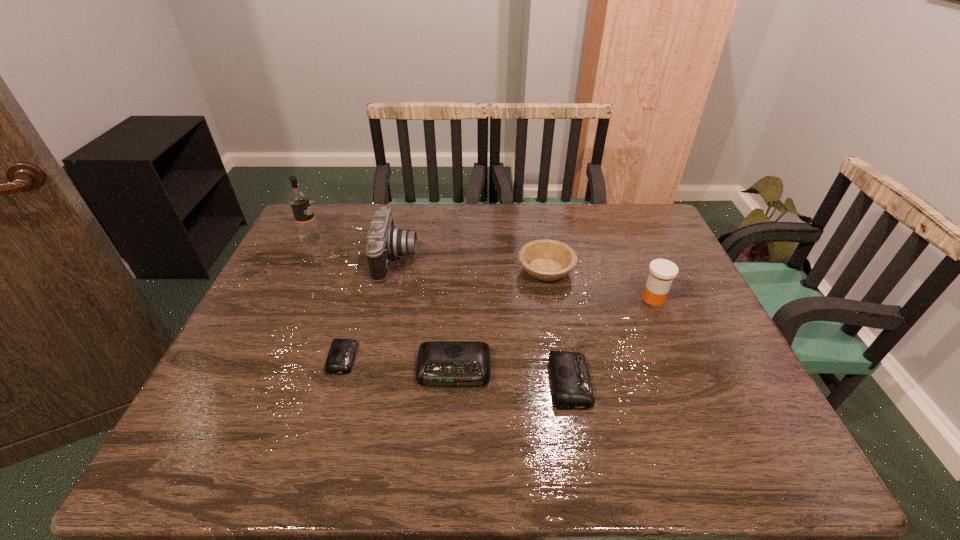
Identify which object is the closest to the second tallest object. Please provide its 2D coordinates. Your answer should be formatted as a tuple, i.e. [(x, y)], where the tuple contains the x and y coordinates of a point satisfying the conditions above.

[(299, 200)]

You are a GUI agent. You are given a task and a screenshot of the screen. Output one action in this format:
    pyautogui.click(x=<x>, y=<y>)
    Task: Click on the object that is the fourth closest to the bowl
    Image resolution: width=960 pixels, height=540 pixels.
    Given the screenshot: What is the action you would take?
    point(385,241)

This screenshot has width=960, height=540. What are the coordinates of `alarm clock object that ranks as the closest to the third tallest object` in the screenshot? It's located at (572, 387).

This screenshot has width=960, height=540. What are the coordinates of `alarm clock that is the second closest to the second alarm clock from right to left` in the screenshot? It's located at (342, 353).

Where is `free space in the image that satisfies the following two spatial constraints: 1. on the front side of the bowl; 2. on the display of the shortest alarm clock`? Image resolution: width=960 pixels, height=540 pixels. free space in the image that satisfies the following two spatial constraints: 1. on the front side of the bowl; 2. on the display of the shortest alarm clock is located at coordinates (562, 358).